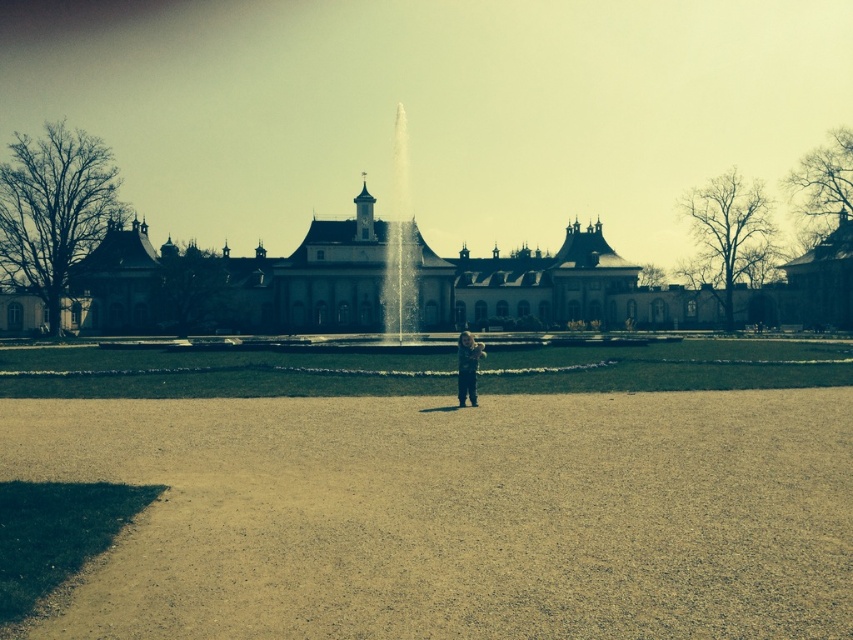
Who is positioned more to the right, clear glass water at center or light brown fabric child at center?

light brown fabric child at center is more to the right.

Looking at this image, can you confirm if clear glass water at center is smaller than light brown fabric child at center?

Incorrect, clear glass water at center is not smaller in size than light brown fabric child at center.

The width and height of the screenshot is (853, 640). What do you see at coordinates (399, 246) in the screenshot?
I see `clear glass water at center` at bounding box center [399, 246].

You are a GUI agent. You are given a task and a screenshot of the screen. Output one action in this format:
    pyautogui.click(x=<x>, y=<y>)
    Task: Click on the clear glass water at center
    
    Given the screenshot: What is the action you would take?
    pyautogui.click(x=399, y=246)

Can you confirm if brown gravel path at center is positioned to the right of clear glass water at center?

Correct, you'll find brown gravel path at center to the right of clear glass water at center.

Which of these two, brown gravel path at center or clear glass water at center, stands shorter?

With less height is brown gravel path at center.

Which is behind, point (801, 488) or point (393, 163)?

Positioned behind is point (393, 163).

In order to click on brown gravel path at center in this screenshot , I will do `click(427, 493)`.

Does brown gravel path at center lie behind light brown fabric child at center?

No, it is not.

Where is `brown gravel path at center`? This screenshot has height=640, width=853. brown gravel path at center is located at coordinates (427, 493).